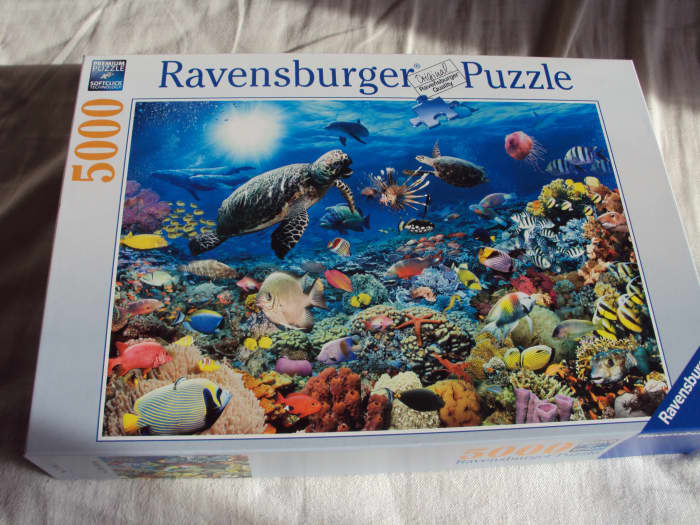
Identify the location of 1 white surface. Image resolution: width=700 pixels, height=525 pixels. (45, 34).